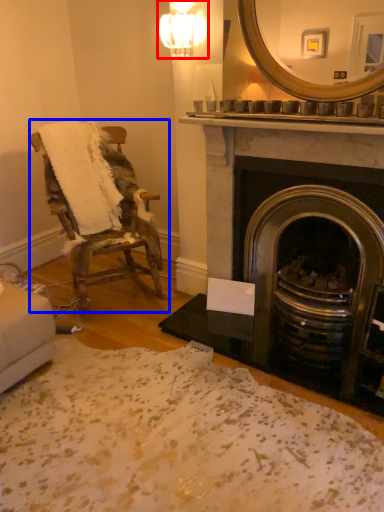
Question: Which of the following is the farthest to the observer, light fixture (highlighted by a red box) or chair (highlighted by a blue box)?

Choices:
 (A) light fixture
 (B) chair

Answer: (A)